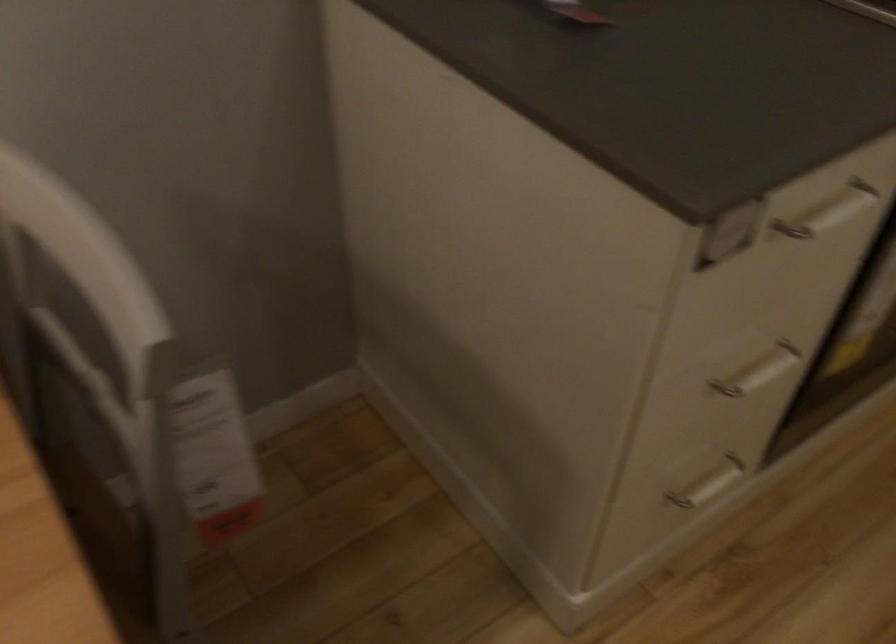
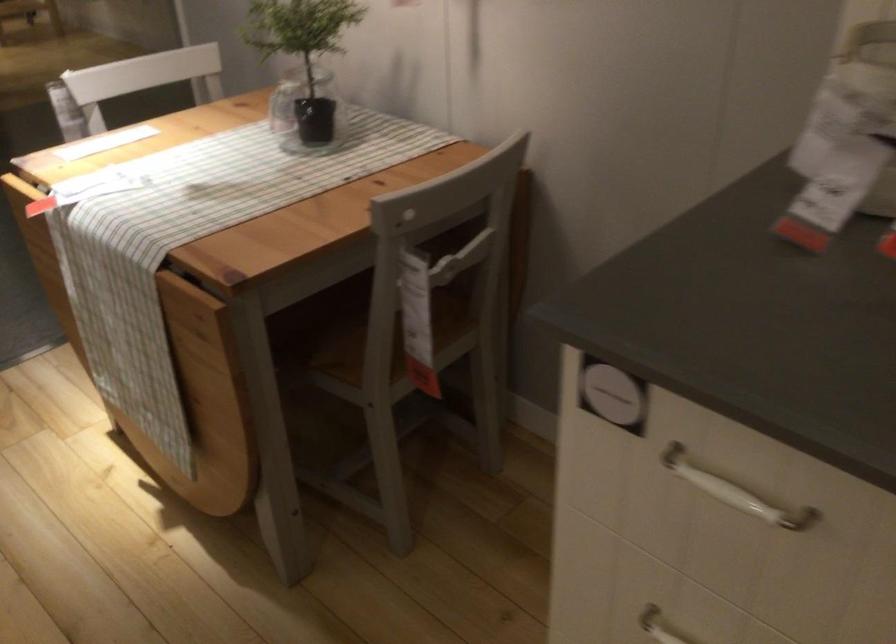
In the second image, find the point that corresponds to point (804, 230) in the first image.

(734, 491)